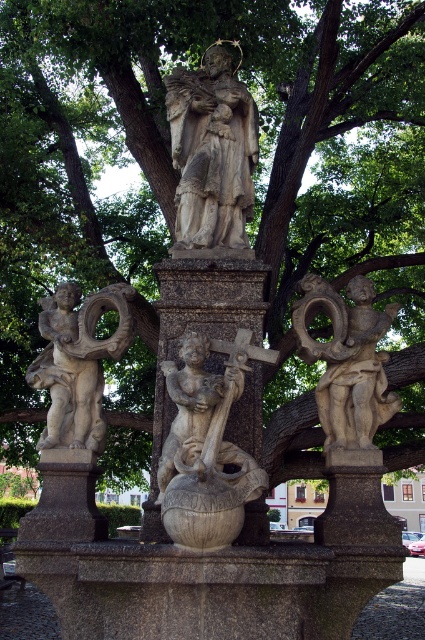
You are a maintenance worker tasked with cleaning the stone statue at center and the matte stone cherub at right. You have a 5.5 meter long extension pole. Can you reach both objects from your current position without moving? Explain your reasoning.

The stone statue at center is 5.80 meters away from the matte stone cherub at right. Since the extension pole is only 5.5 meters long, it is shorter than the distance between them. Therefore, you cannot reach both objects without moving your position because the pole isn not long enough to cover the 5.80 meter gap.

You are an art student analyzing the sculpture. You notice the carved stone cherub at center and the stone statue at center. Based on their positions, which one is located higher up?

The stone statue at center is higher up than the carved stone cherub at center because the carved stone cherub at center is below the stone statue at center.